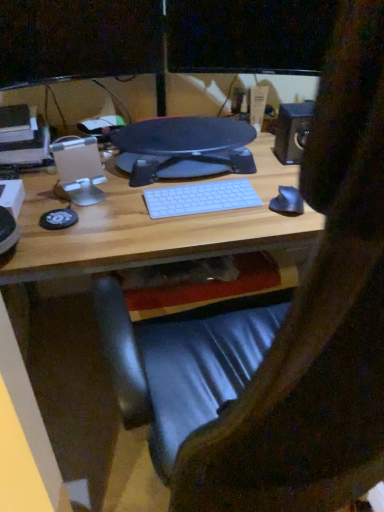
What are the coordinates of `unoccupied area in front of metallic black speaker at upper right` in the screenshot? It's located at (279, 178).